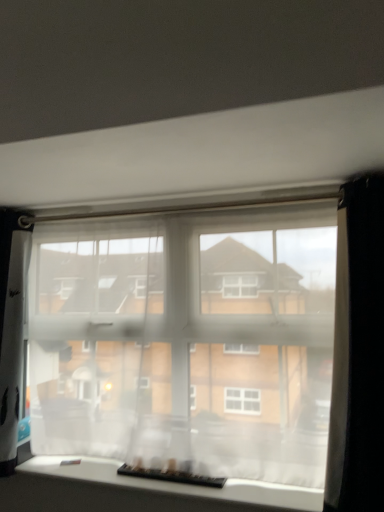
At what (x,y) coordinates should I click in order to perform the action: click on free space in front of black plastic keyboard at lower center. Please return your answer as a coordinate pair (x, y). The image size is (384, 512). Looking at the image, I should click on (165, 483).